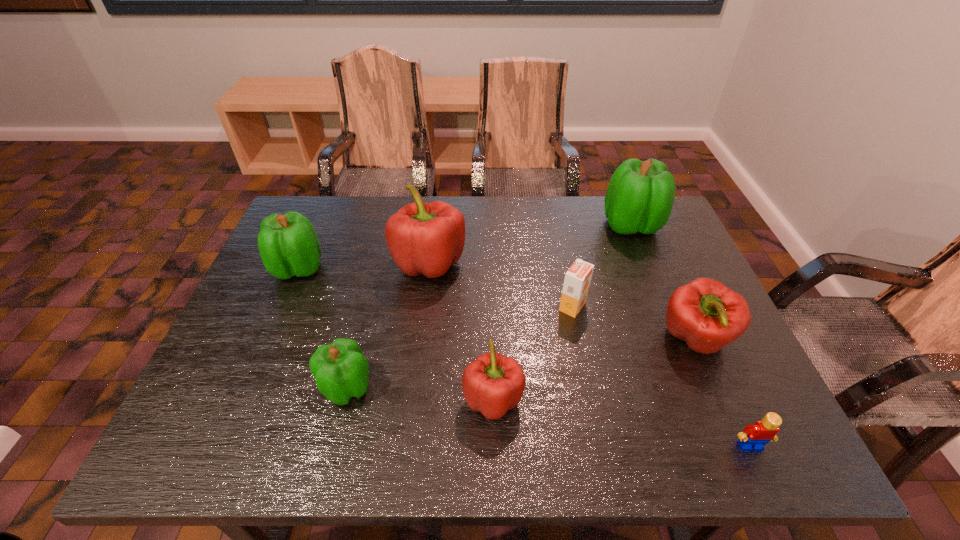
I want to click on the smallest green bell pepper, so click(x=340, y=370).

At what (x,y) coordinates should I click in order to perform the action: click on the nearest green bell pepper. Please return your answer as a coordinate pair (x, y). Looking at the image, I should click on (340, 370).

You are a GUI agent. You are given a task and a screenshot of the screen. Output one action in this format:
    pyautogui.click(x=<x>, y=<y>)
    Task: Click on the smallest pink bell pepper
    
    Given the screenshot: What is the action you would take?
    pyautogui.click(x=492, y=384)

Where is `the second pink bell pepper from right to left`? This screenshot has width=960, height=540. the second pink bell pepper from right to left is located at coordinates (492, 384).

The height and width of the screenshot is (540, 960). In order to click on red Lego in this screenshot , I will do `click(754, 437)`.

In order to click on the nearest object in this screenshot , I will do 754,437.

Find the location of a particular element. Image resolution: width=960 pixels, height=540 pixels. free space located 0.250m on the front of the rightmost green bell pepper is located at coordinates (663, 305).

Locate an element on the screen. This screenshot has height=540, width=960. free space located 0.120m on the front of the biggest pink bell pepper is located at coordinates (421, 323).

Where is `vacant region located on the front of the second nearest green bell pepper`? The image size is (960, 540). vacant region located on the front of the second nearest green bell pepper is located at coordinates (238, 406).

Locate an element on the screen. vacant area situated on the back of the second biggest pink bell pepper is located at coordinates point(658,254).